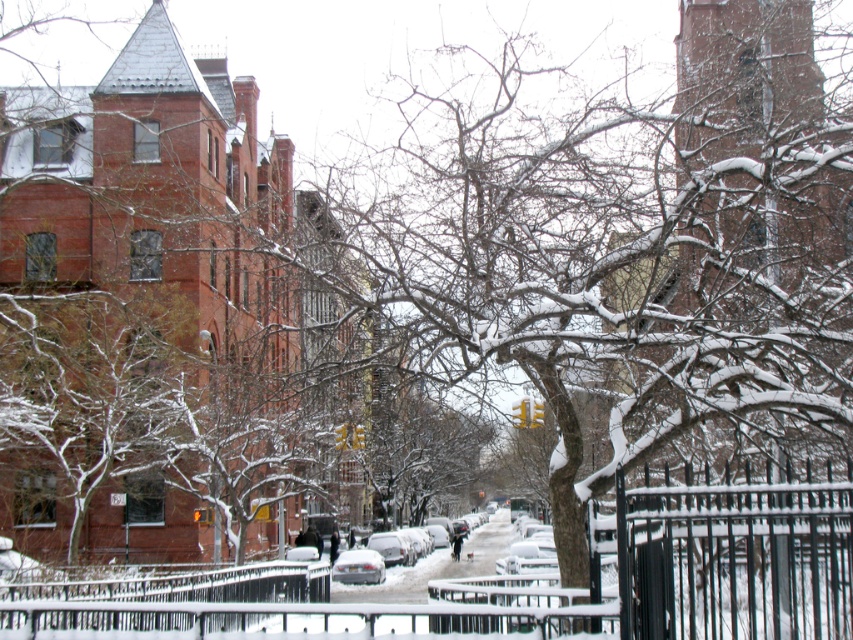
Consider the image. Is black metal fence at lower center to the left of silver metallic car at center from the viewer's perspective?

Yes, black metal fence at lower center is to the left of silver metallic car at center.

Is point (10, 608) closer to viewer compared to point (415, 573)?

Yes, it is.

Identify the location of black metal fence at lower center. (163, 598).

The width and height of the screenshot is (853, 640). Identify the location of black metal fence at lower center. (163, 598).